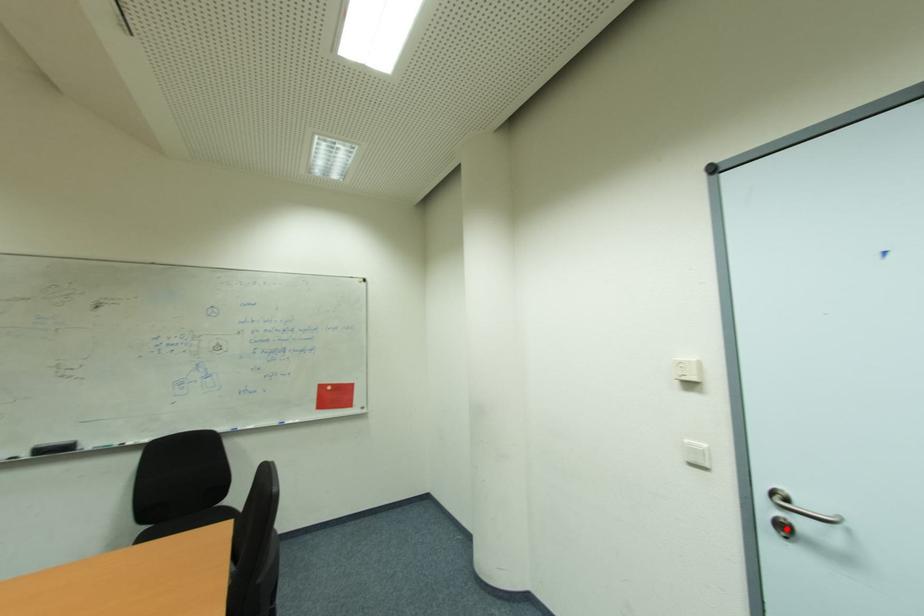
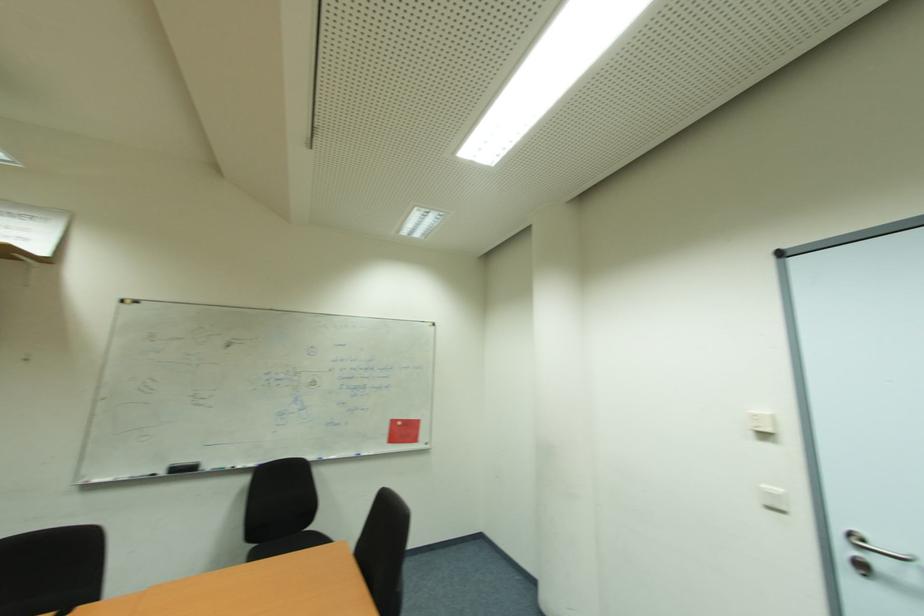
In the second image, find the point that corresponds to the highlighted location in the first image.

(869, 570)